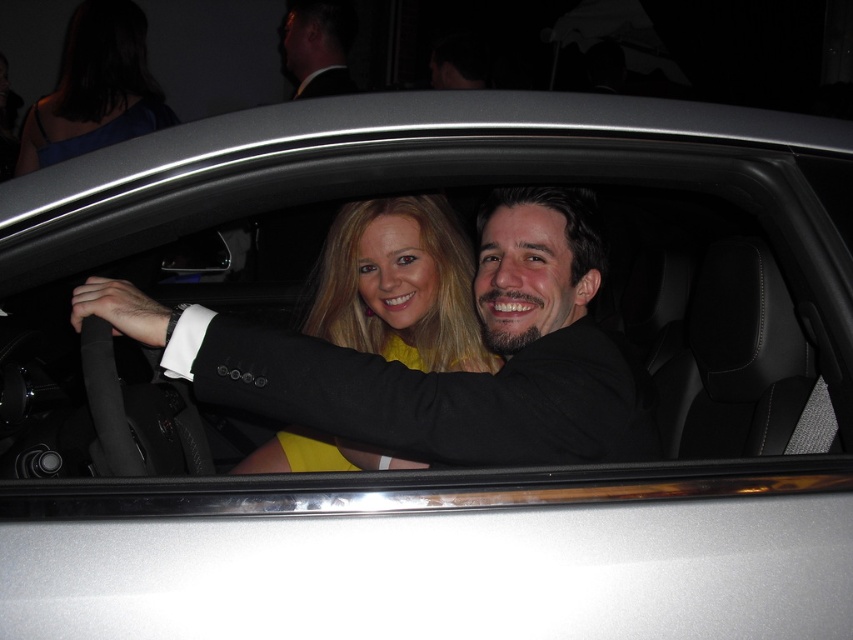
Does blue satin dress at upper left appear over black suit at upper left?

No, blue satin dress at upper left is not above black suit at upper left.

Can you confirm if blue satin dress at upper left is smaller than black suit at upper left?

Indeed, blue satin dress at upper left has a smaller size compared to black suit at upper left.

Is point (79, 4) farther from viewer compared to point (339, 3)?

Yes, point (79, 4) is behind point (339, 3).

Where is `blue satin dress at upper left`? blue satin dress at upper left is located at coordinates (96, 88).

Does yellow matte dress at center appear under blue satin dress at upper left?

Yes.

Is yellow matte dress at center thinner than blue satin dress at upper left?

Correct, yellow matte dress at center's width is less than blue satin dress at upper left's.

At what (x,y) coordinates should I click in order to perform the action: click on yellow matte dress at center. Please return your answer as a coordinate pair (x, y). Looking at the image, I should click on (399, 285).

Which is in front, point (328, 442) or point (318, 48)?

Positioned in front is point (328, 442).

Can you confirm if yellow matte dress at center is thinner than black suit at upper left?

In fact, yellow matte dress at center might be wider than black suit at upper left.

Is point (366, 291) in front of point (285, 72)?

Yes, point (366, 291) is closer to viewer.

Image resolution: width=853 pixels, height=640 pixels. I want to click on yellow matte dress at center, so click(x=399, y=285).